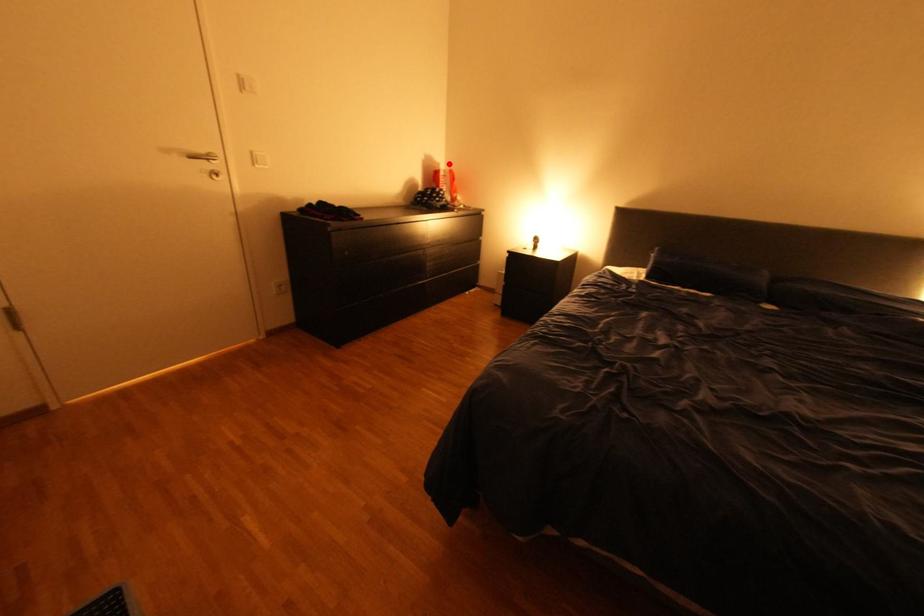
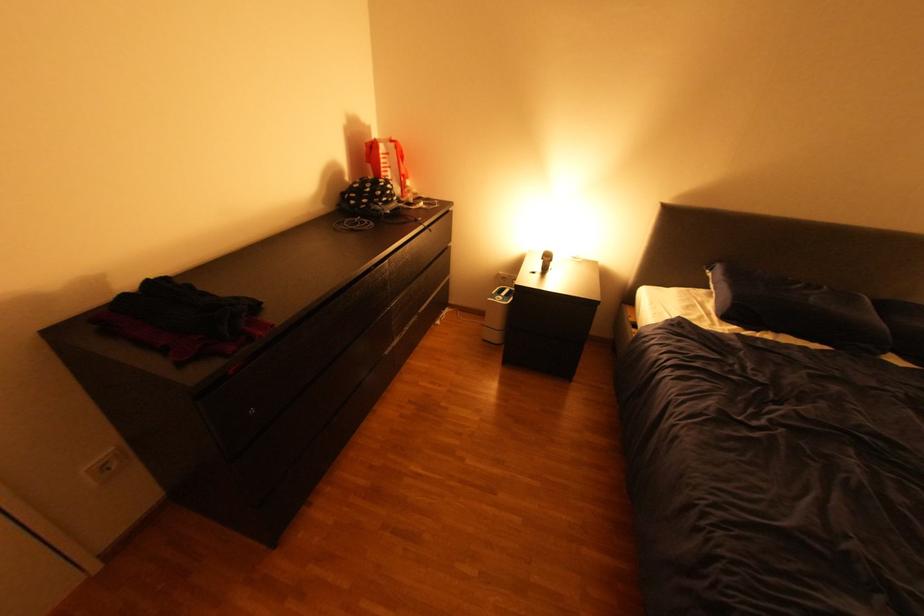
In the second image, find the point that corresponds to the highlighted location in the first image.

(379, 129)